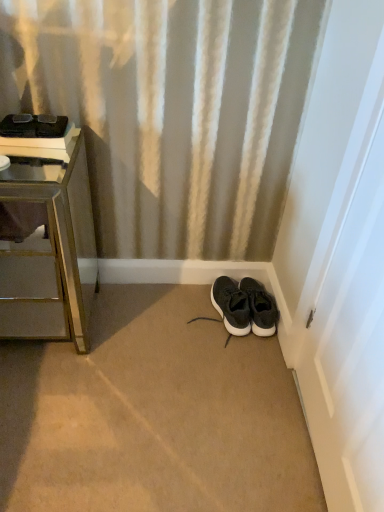
Locate an element on the screen. The width and height of the screenshot is (384, 512). free space in front of brushed metal nightstand at left is located at coordinates (51, 411).